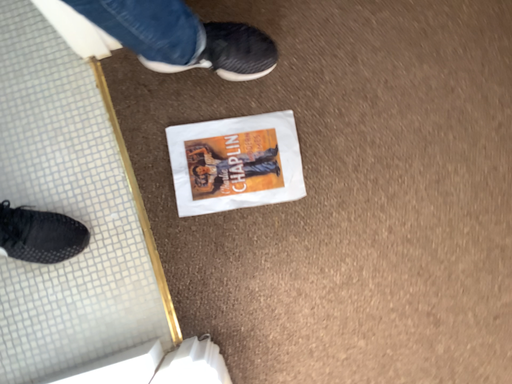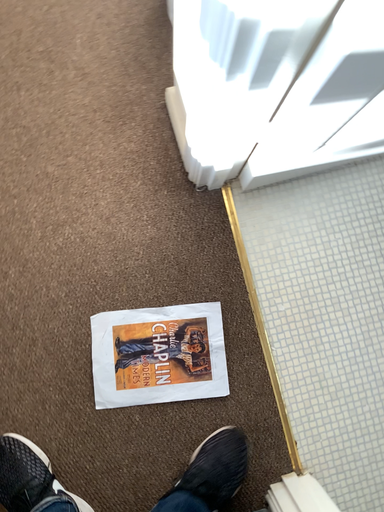
Question: How did the camera likely rotate when shooting the video?

Choices:
 (A) rotated upward
 (B) rotated downward

Answer: (A)